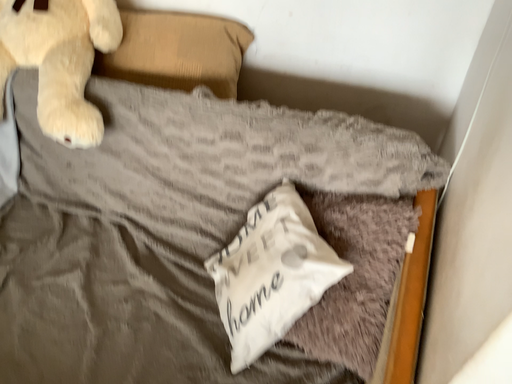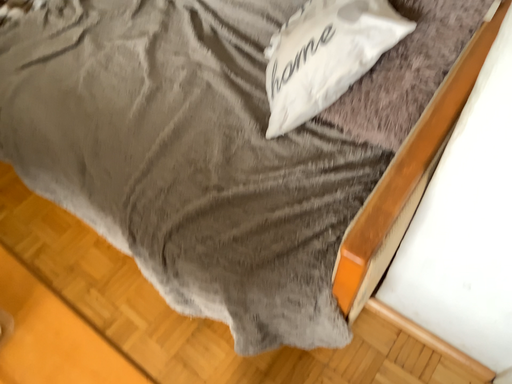
Question: How did the camera likely rotate when shooting the video?

Choices:
 (A) rotated right
 (B) rotated left

Answer: (B)